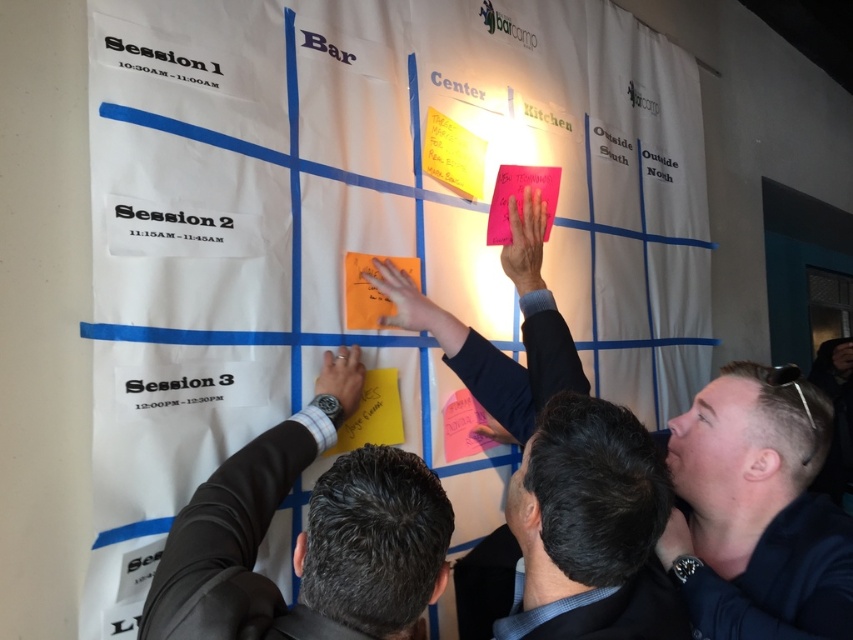
Does dark brown hair at center have a greater width compared to yellow paper at center?

Yes, dark brown hair at center is wider than yellow paper at center.

Does dark brown hair at center have a lesser height compared to yellow paper at center?

In fact, dark brown hair at center may be taller than yellow paper at center.

Is point (614, 460) positioned behind point (373, 417)?

No.

Where is `dark brown hair at center`? dark brown hair at center is located at coordinates (590, 529).

Between point (540, 538) and point (376, 298), which one is positioned behind?

The point (376, 298) is behind.

Does dark brown hair at center appear over orange matte sticky note at center?

No, dark brown hair at center is not above orange matte sticky note at center.

Image resolution: width=853 pixels, height=640 pixels. In order to click on dark brown hair at center in this screenshot , I will do `click(590, 529)`.

This screenshot has width=853, height=640. I want to click on dark brown hair at center, so click(x=590, y=529).

Who is lower down, yellow paper at center or pink matte sticky note at upper right?

Positioned lower is yellow paper at center.

Who is positioned more to the left, yellow paper at center or pink matte sticky note at upper right?

yellow paper at center is more to the left.

Image resolution: width=853 pixels, height=640 pixels. What do you see at coordinates (373, 413) in the screenshot? I see `yellow paper at center` at bounding box center [373, 413].

Find the location of a particular element. The height and width of the screenshot is (640, 853). yellow paper at center is located at coordinates (373, 413).